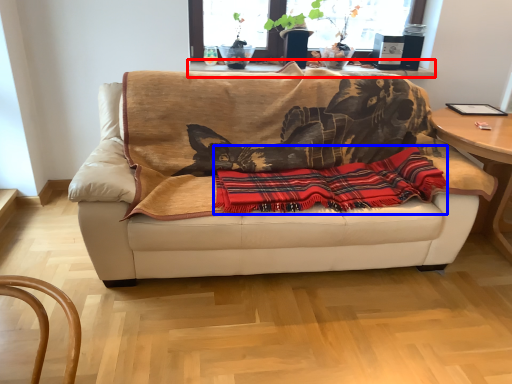
Question: Which point is further to the camera, table (highlighted by a red box) or plaid (highlighted by a blue box)?

Choices:
 (A) table
 (B) plaid

Answer: (A)